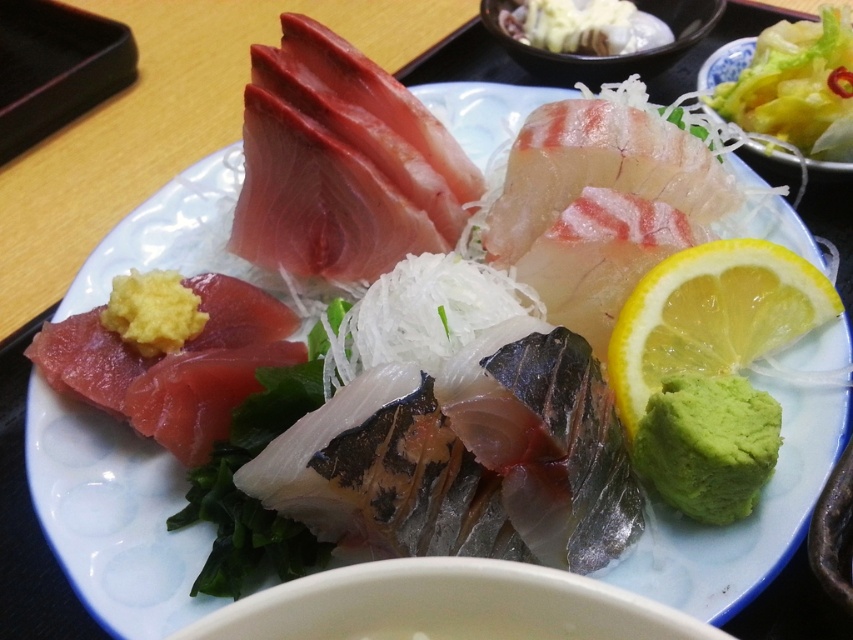
You are a food critic sitting at a table with the plate of sashimi. You want to squeeze the yellow juicy lemon at right onto your sashimi. Can you reach it without moving your chair?

The yellow juicy lemon at right is 3.45 feet away from the viewer. Since the average arm length is about 2.5 feet, you cannot reach the yellow juicy lemon at right without moving your chair.

You are a food critic standing 36 inches away from the green paste at lower right. Can you reach it without moving your body?

The green paste at lower right is 35.99 inches away from the viewer, so yes, you can reach it without moving your body since the distance is just under 36 inches.

You are a chef preparing to garnish a sashimi platter. You have a yellow juicy lemon at right and translucent white shredded vegetables at upper right. Which garnish has a greater width?

The yellow juicy lemon at right has a greater width than the translucent white shredded vegetables at upper right.